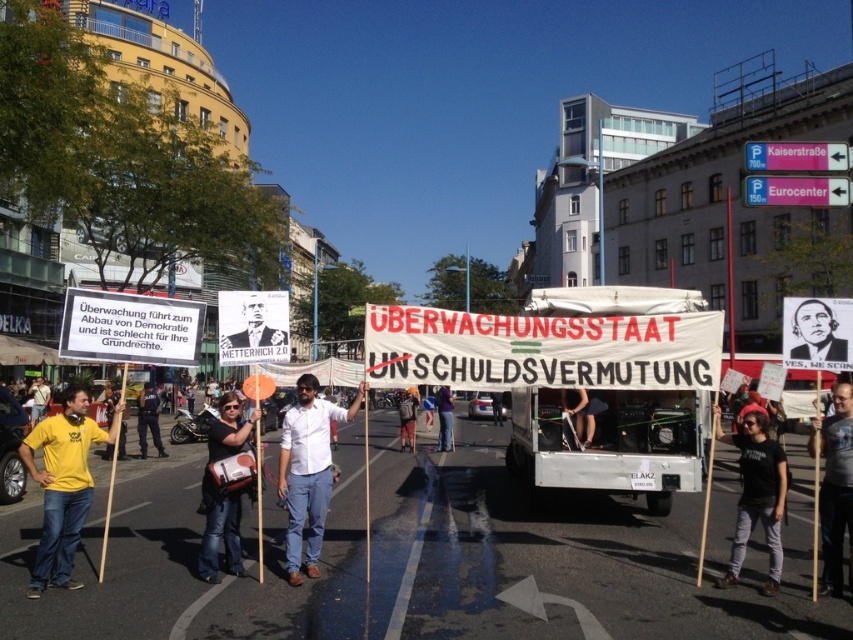
Looking at this image, you are a photographer standing at the edge of the protest. You want to take a photo that includes both the denim pants at center and the yellow shirt at center. If your camera has a maximum focus range of 10 meters, will you be able to capture both subjects clearly in the same frame?

The denim pants at center is 9.57 meters away from yellow shirt at center. Since the maximum focus range is 10 meters, the distance between them is within the camera range. Therefore, both subjects can be captured clearly in the same frame.

You are a photographer taking a picture of the protest scene. You notice the black matte poster at center and the denim pants at center. Which object should you focus on to ensure the smaller one is in sharp focus?

The black matte poster at center is smaller than the denim pants at center, so you should focus on the black matte poster at center to ensure the smaller one is in sharp focus.

You are a photographer at the protest, standing behind the crowd. You want to take a photo of the yellow shirt at center and denim pants at center. Which one should you focus on first if you want to capture both in the frame?

You should focus on the yellow shirt at center first because the denim pants at center is to the right of it, so adjusting the frame to include both would require ensuring the yellow shirt is centered before accounting for the denim pants to the right.